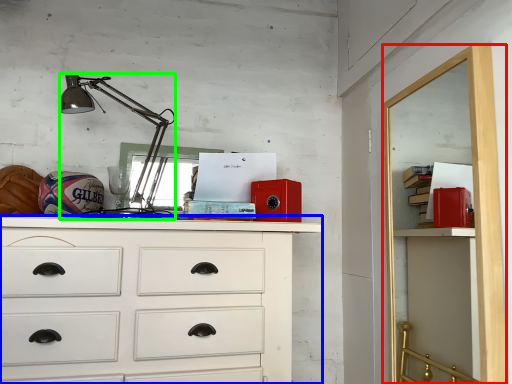
Question: Considering the real-world distances, which object is farthest from file cabinet (highlighted by a red box)? chest of drawers (highlighted by a blue box) or lamp (highlighted by a green box)?

Choices:
 (A) chest of drawers
 (B) lamp

Answer: (B)